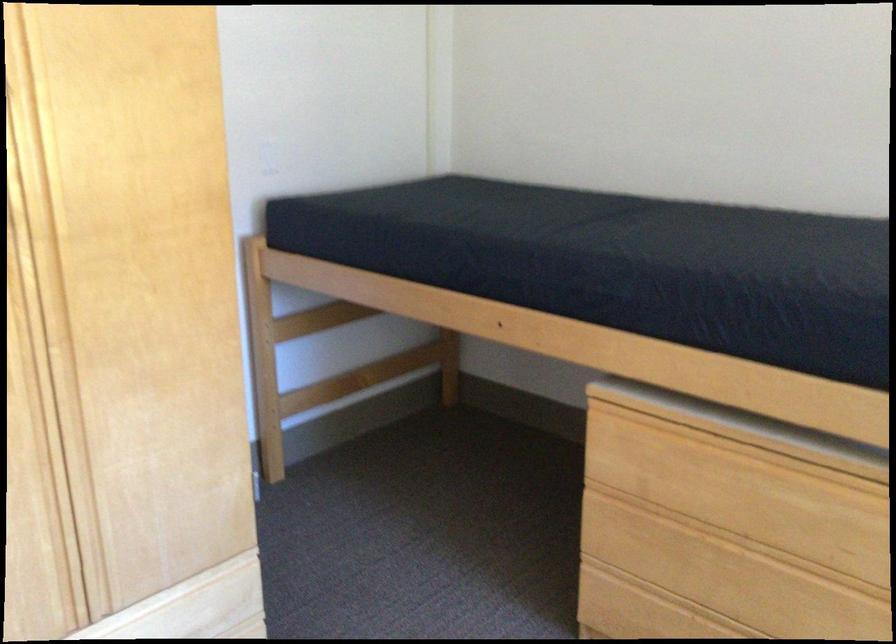
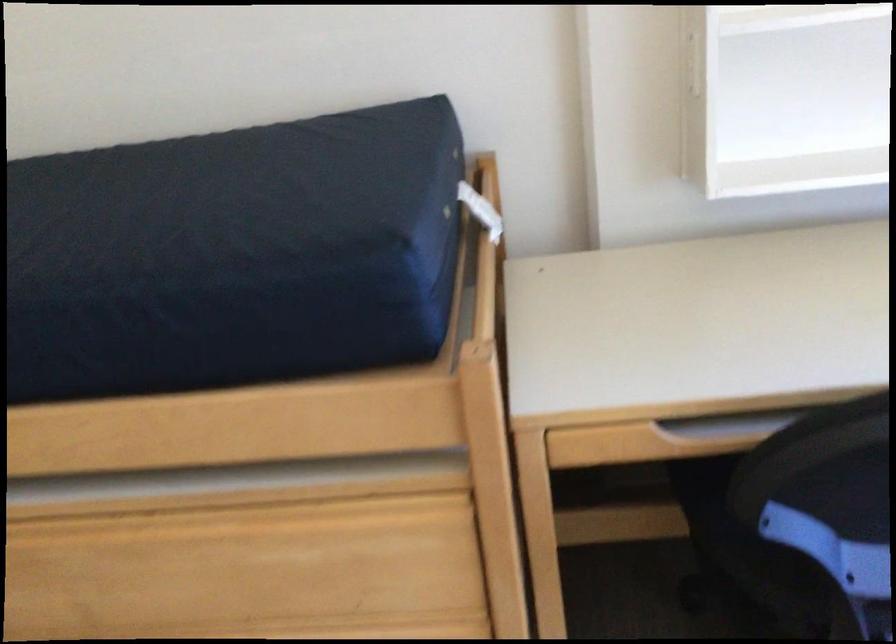
Question: The camera is either moving clockwise (left) or counter-clockwise (right) around the object. The first image is from the beginning of the video and the second image is from the end. Is the camera moving left or right when shooting the video?

Choices:
 (A) Left
 (B) Right

Answer: (A)